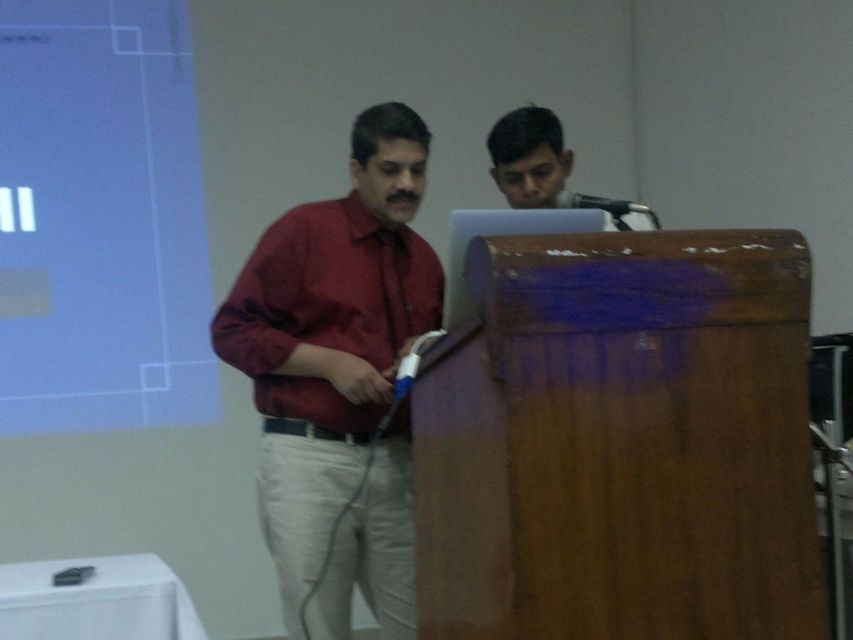
Question: Is matte red shirt at center closer to the viewer compared to smooth skin face at upper center?

Choices:
 (A) no
 (B) yes

Answer: (A)

Question: Can you confirm if white matte projection screen at upper left is positioned below matte red shirt at center?

Choices:
 (A) no
 (B) yes

Answer: (A)

Question: Observing the image, what is the correct spatial positioning of maroon shirt at center in reference to matte red shirt at center?

Choices:
 (A) below
 (B) above

Answer: (A)

Question: Which point is farther from the camera taking this photo?

Choices:
 (A) (287, 348)
 (B) (624, 211)

Answer: (A)

Question: Which of the following is the farthest from the observer?

Choices:
 (A) (97, 177)
 (B) (293, 464)

Answer: (A)

Question: Which point is closer to the camera?

Choices:
 (A) (370, 221)
 (B) (553, 132)

Answer: (A)